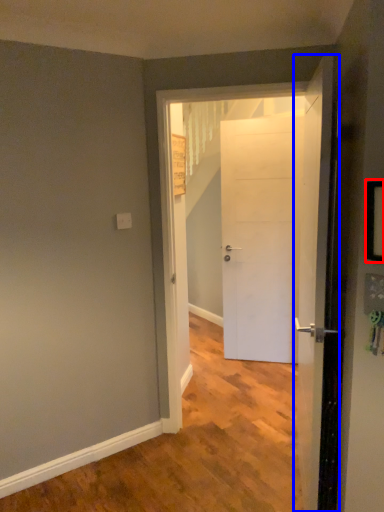
Question: Which object is closer to the camera taking this photo, picture frame (highlighted by a red box) or door (highlighted by a blue box)?

Choices:
 (A) picture frame
 (B) door

Answer: (A)